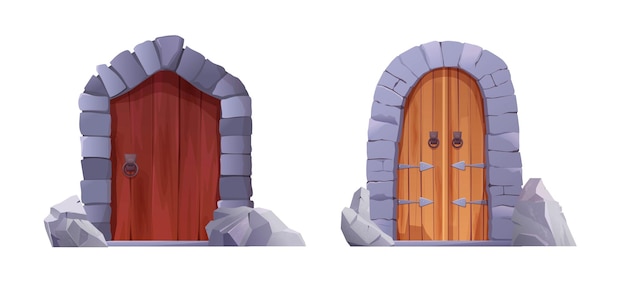
Where is `red door`? red door is located at coordinates (173, 162).